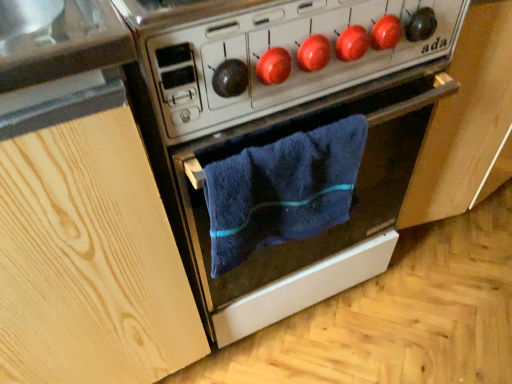
Question: Does light wood cabinet at left have a greater width compared to metallic stove at center?

Choices:
 (A) no
 (B) yes

Answer: (B)

Question: Considering the relative positions of light wood cabinet at left and metallic stove at center in the image provided, is light wood cabinet at left to the right of metallic stove at center from the viewer's perspective?

Choices:
 (A) no
 (B) yes

Answer: (A)

Question: From a real-world perspective, is light wood cabinet at left positioned over metallic stove at center based on gravity?

Choices:
 (A) yes
 (B) no

Answer: (B)

Question: Considering the relative sizes of light wood cabinet at left and metallic stove at center in the image provided, is light wood cabinet at left bigger than metallic stove at center?

Choices:
 (A) yes
 (B) no

Answer: (A)

Question: Is light wood cabinet at left behind metallic stove at center?

Choices:
 (A) no
 (B) yes

Answer: (A)

Question: Is light wood cabinet at left touching metallic stove at center?

Choices:
 (A) yes
 (B) no

Answer: (B)

Question: Is metallic stove at center to the right of metallic silver oven at center from the viewer's perspective?

Choices:
 (A) yes
 (B) no

Answer: (B)

Question: Considering the relative sizes of metallic stove at center and metallic silver oven at center in the image provided, is metallic stove at center thinner than metallic silver oven at center?

Choices:
 (A) no
 (B) yes

Answer: (B)

Question: Considering the relative sizes of metallic stove at center and metallic silver oven at center in the image provided, is metallic stove at center taller than metallic silver oven at center?

Choices:
 (A) no
 (B) yes

Answer: (A)

Question: Is metallic stove at center surrounding metallic silver oven at center?

Choices:
 (A) yes
 (B) no

Answer: (B)

Question: Could you tell me if metallic stove at center is facing metallic silver oven at center?

Choices:
 (A) yes
 (B) no

Answer: (B)

Question: Does metallic stove at center have a greater width compared to metallic silver oven at center?

Choices:
 (A) no
 (B) yes

Answer: (A)

Question: Is light wood cabinet at left smaller than metallic silver oven at center?

Choices:
 (A) no
 (B) yes

Answer: (A)